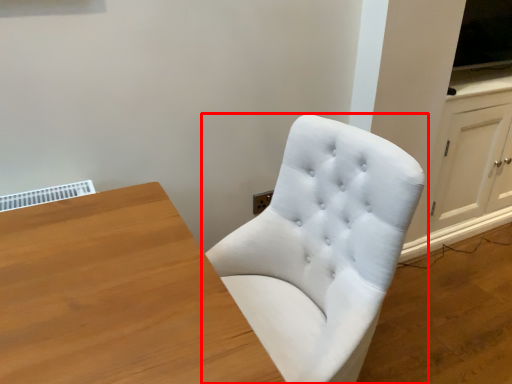
Question: From the image's perspective, where is chair (annotated by the red box) located relative to dresser?

Choices:
 (A) above
 (B) below

Answer: (B)